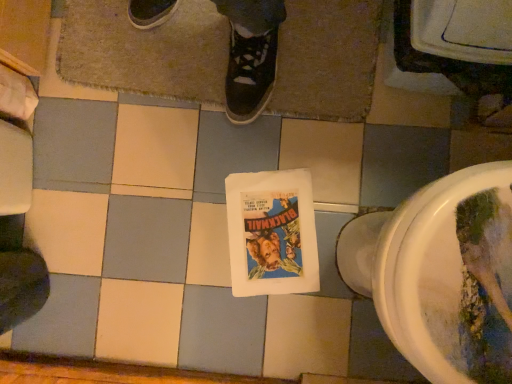
I want to click on free space in front of brown textured bath mat at upper center, so click(264, 230).